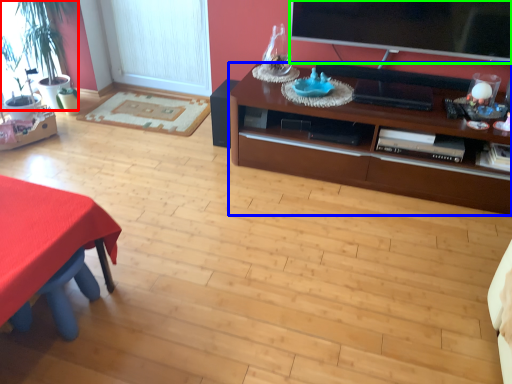
Question: Considering the real-world distances, which object is closest to houseplant (highlighted by a red box)? cabinetry (highlighted by a blue box) or television (highlighted by a green box).

Choices:
 (A) cabinetry
 (B) television

Answer: (A)